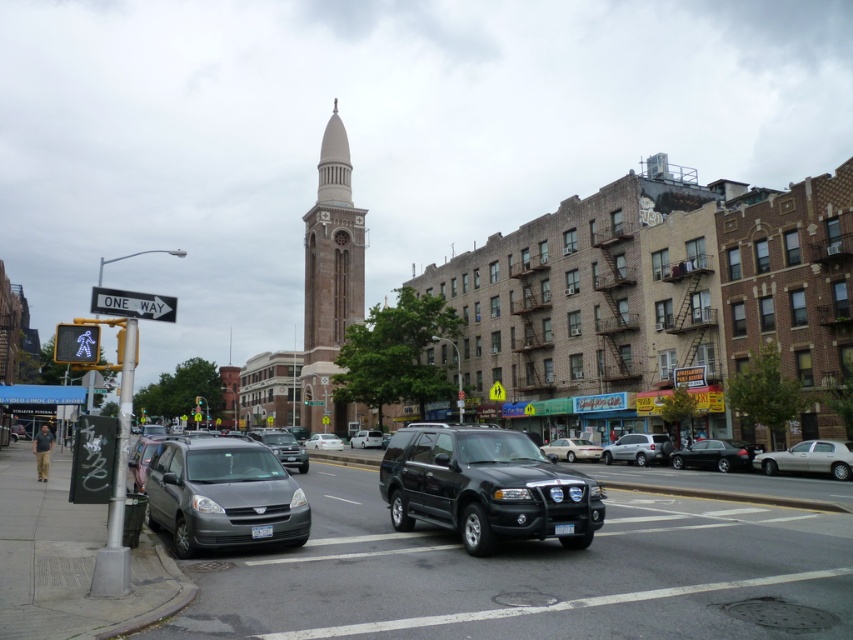
Question: Which point appears closest to the camera in this image?

Choices:
 (A) (544, 477)
 (B) (740, 456)
 (C) (577, 452)

Answer: (A)

Question: Can you confirm if light brown stone tower at center is positioned below white matte van at center?

Choices:
 (A) no
 (B) yes

Answer: (A)

Question: Is black matte suv at center closer to the viewer compared to white matte sedan at center?

Choices:
 (A) yes
 (B) no

Answer: (A)

Question: Which of the following is the farthest from the observer?

Choices:
 (A) (660, 442)
 (B) (207, 490)

Answer: (A)

Question: Is matte black sedan at center to the right of white matte sedan at center from the viewer's perspective?

Choices:
 (A) yes
 (B) no

Answer: (B)

Question: Which point is farther from the camera taking this photo?

Choices:
 (A) (149, 492)
 (B) (693, 456)
 (C) (346, 280)

Answer: (C)